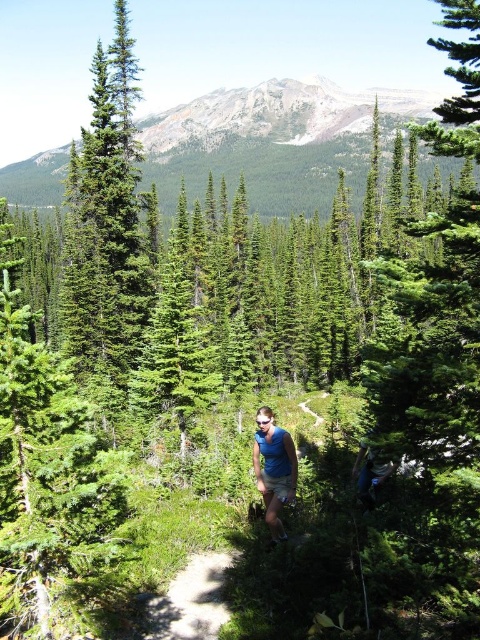
Question: Observing the image, what is the correct spatial positioning of green textured mountain at upper center in reference to blue fabric shirt at center?

Choices:
 (A) right
 (B) left

Answer: (B)

Question: Which object appears farthest from the camera in this image?

Choices:
 (A) blue fabric shirt at center
 (B) green textured mountain at upper center
 (C) dirt path at center
 (D) green fir tree at left

Answer: (B)

Question: Estimate the real-world distances between objects in this image. Which object is closer to the blue fabric shirt at center?

Choices:
 (A) green textured mountain at upper center
 (B) green fir tree at left
 (C) dirt path at center

Answer: (C)

Question: Is green fir tree at left smaller than dirt path at center?

Choices:
 (A) no
 (B) yes

Answer: (A)

Question: Can you confirm if green textured mountain at upper center is thinner than green fir tree at left?

Choices:
 (A) no
 (B) yes

Answer: (A)

Question: Among these points, which one is nearest to the camera?

Choices:
 (A) (82, 154)
 (B) (362, 150)
 (C) (202, 572)

Answer: (C)